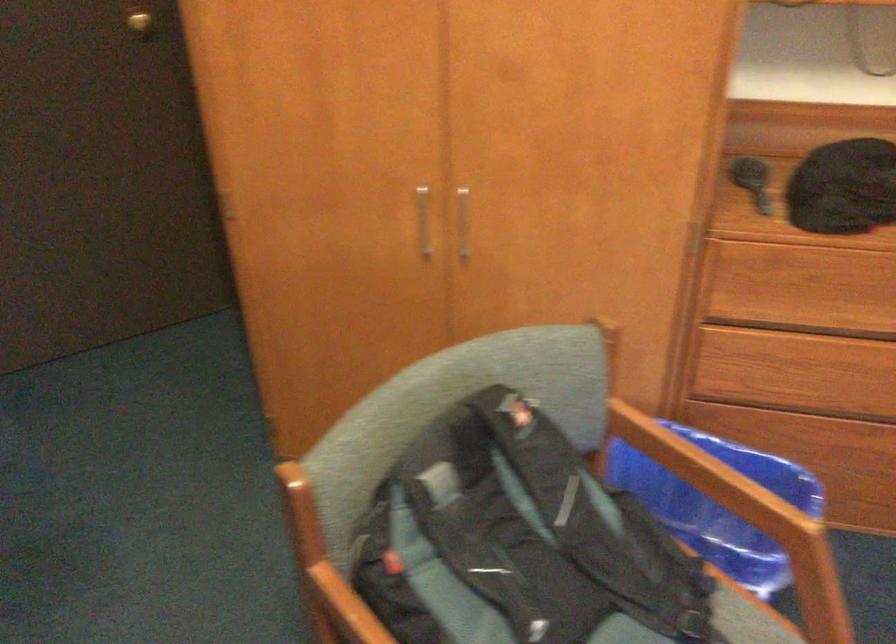
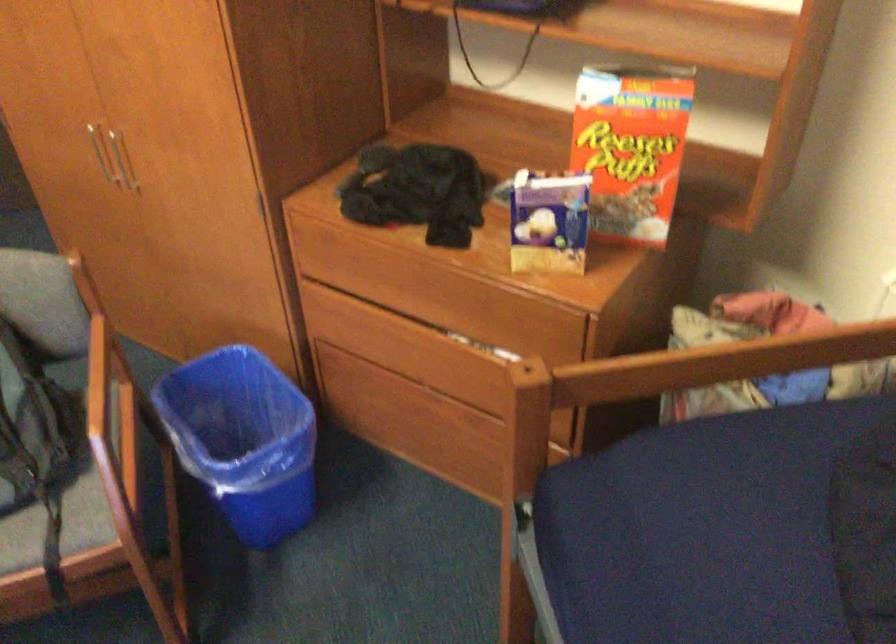
Find the pixel in the second image that matches pixel 431 198 in the first image.

(97, 149)